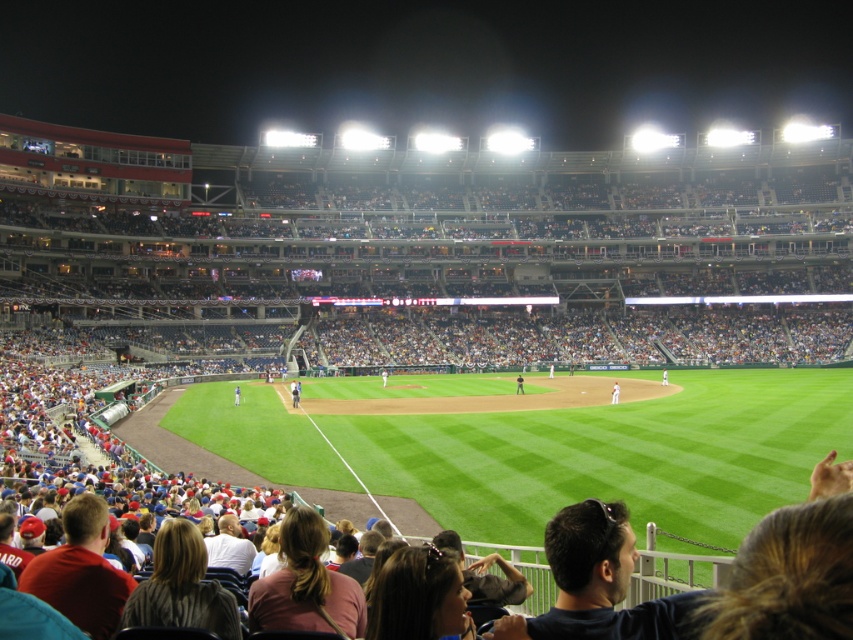
Question: Is white jersey at center to the right of white uniformed player at center from the viewer's perspective?

Choices:
 (A) no
 (B) yes

Answer: (A)

Question: Which object is positioned farthest from the blue uniformed player at center?

Choices:
 (A) white uniformed player at center
 (B) white uniformed person at center

Answer: (A)

Question: Does white jersey at center appear on the right side of white uniformed player at center?

Choices:
 (A) yes
 (B) no

Answer: (B)

Question: Is white uniformed player at center positioned before white uniformed person at center?

Choices:
 (A) no
 (B) yes

Answer: (B)

Question: Estimate the real-world distances between objects in this image. Which object is farther from the blue uniformed player at center?

Choices:
 (A) white jersey at center
 (B) white uniformed person at center
 (C) white uniformed player at center

Answer: (C)

Question: Which point is closer to the camera?

Choices:
 (A) (234, 397)
 (B) (517, 376)

Answer: (A)